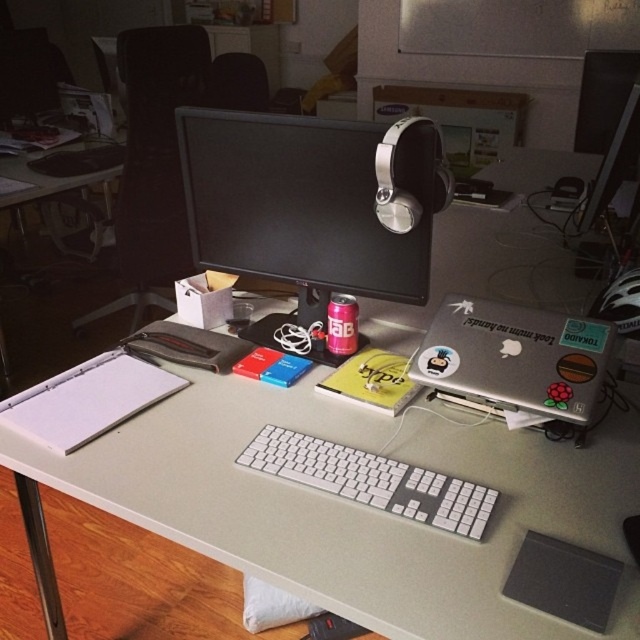
In the scene shown: You are a delivery robot with a package that needs to be placed on the desk. The package is 1 meter long. Can you fit the package horizontally on the desk without it overlapping the silver metallic laptop at center?

The silver metallic laptop at center is 1.01 meters away from the camera, but the desk length isn not provided. Therefore, it is impossible to determine if the package will fit without additional information about the desk size.

You are setting up a new webcam for a video call. The webcam needs to be placed in front of the matte black monitor at center so that it faces the user. However, there is a silver metallic laptop at center in the way. Can you move the laptop to make space?

The silver metallic laptop at center is behind the matte black monitor at center, so moving it forward would allow space in front of the matte black monitor at center for the webcam.

You are setting up a new webcam for a video call and need to position it so it faces both the matte black monitor at center and the silver metallic laptop at center. Based on their positions, where should you place the webcam to capture both objects in the frame?

The matte black monitor at center is above the silver metallic laptop at center, so placing the webcam slightly above the monitor would ensure both the monitor and the laptop are visible in the frame.